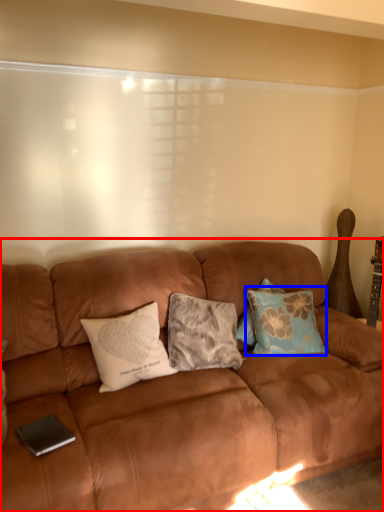
Question: Among these objects, which one is nearest to the camera, studio couch (highlighted by a red box) or pillow (highlighted by a blue box)?

Choices:
 (A) studio couch
 (B) pillow

Answer: (A)